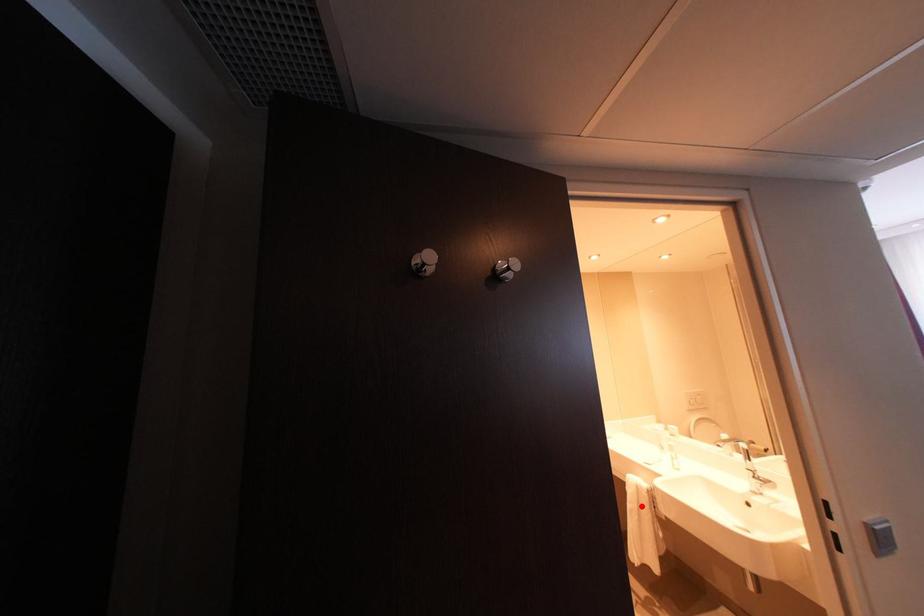
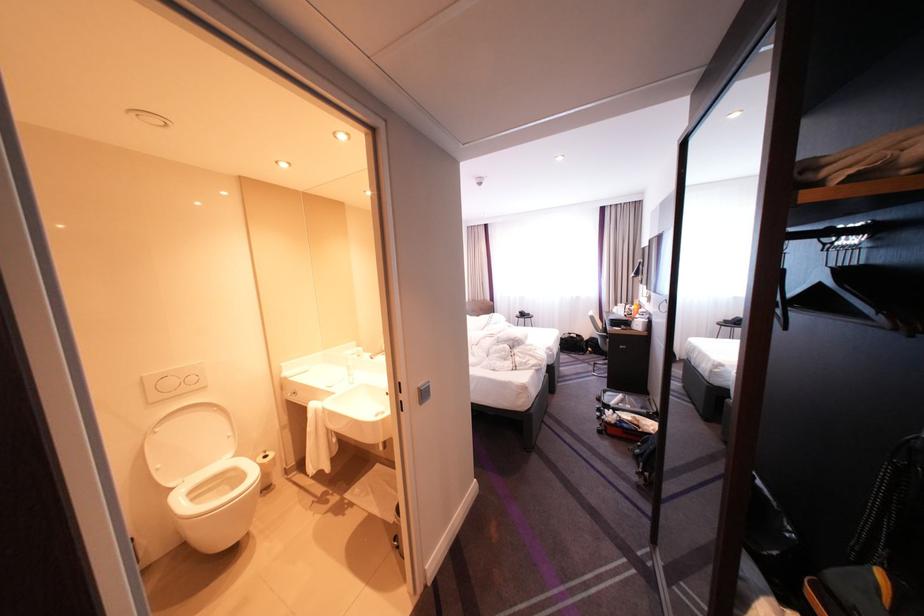
Locate, in the second image, the point that corresponds to the highlighted location in the first image.

(321, 430)